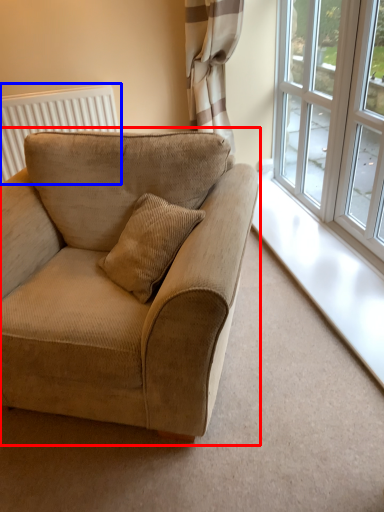
Question: Which of the following is the farthest to the observer, studio couch (highlighted by a red box) or radiator (highlighted by a blue box)?

Choices:
 (A) studio couch
 (B) radiator

Answer: (B)